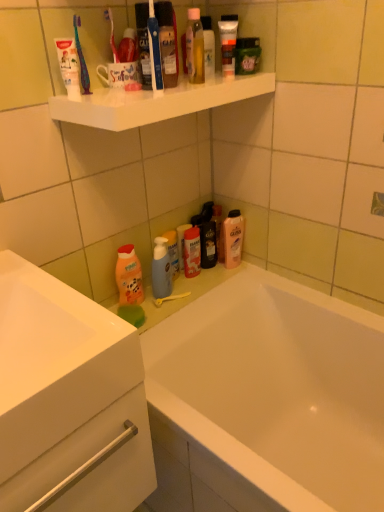
Where is `vacant space in front of translucent plastic bottle at lower center, which ranks as the 3th toiletry in right-to-left order`? vacant space in front of translucent plastic bottle at lower center, which ranks as the 3th toiletry in right-to-left order is located at coordinates (189, 290).